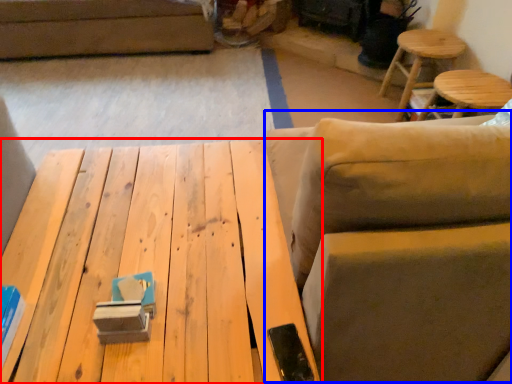
Question: Which point is closer to the camera, table (highlighted by a red box) or swivel chair (highlighted by a blue box)?

Choices:
 (A) table
 (B) swivel chair

Answer: (B)